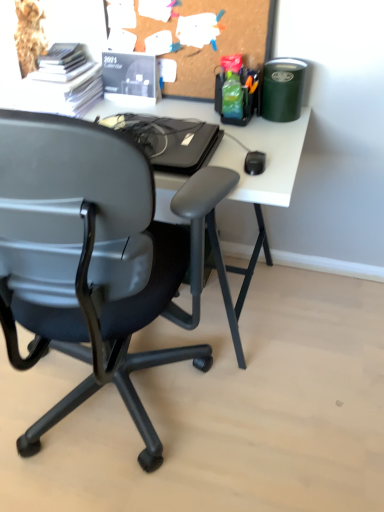
Question: Should I look upward or downward to see white paper stack at upper left, arranged as the 1th stationery when viewed from the left?

Choices:
 (A) down
 (B) up

Answer: (B)

Question: Is white paper stack at upper left, arranged as the 1th stationery when viewed from the left, not inside matte black calendar at upper center, the second stationery in the left-to-right sequence?

Choices:
 (A) no
 (B) yes

Answer: (B)

Question: Can you see white paper stack at upper left, arranged as the 1th stationery when viewed from the left, touching matte black calendar at upper center, the second stationery in the left-to-right sequence?

Choices:
 (A) yes
 (B) no

Answer: (B)

Question: Is matte black calendar at upper center, the second stationery in the left-to-right sequence, a part of white paper stack at upper left, arranged as the 1th stationery when viewed from the left?

Choices:
 (A) yes
 (B) no

Answer: (B)

Question: Can you confirm if white paper stack at upper left, which appears as the fourth stationery when viewed from the right, is positioned to the right of matte black calendar at upper center, which ranks as the 3th stationery in right-to-left order?

Choices:
 (A) no
 (B) yes

Answer: (A)

Question: From the image's perspective, is white paper stack at upper left, which appears as the fourth stationery when viewed from the right, on top of matte black calendar at upper center, the second stationery in the left-to-right sequence?

Choices:
 (A) no
 (B) yes

Answer: (A)

Question: Can you confirm if white paper stack at upper left, which appears as the fourth stationery when viewed from the right, is thinner than matte black calendar at upper center, the second stationery in the left-to-right sequence?

Choices:
 (A) yes
 (B) no

Answer: (B)

Question: From the image's perspective, is matte black calendar at upper center, which ranks as the 3th stationery in right-to-left order, under corkboard at upper center?

Choices:
 (A) no
 (B) yes

Answer: (B)

Question: Is matte black calendar at upper center, which ranks as the 3th stationery in right-to-left order, positioned far away from corkboard at upper center?

Choices:
 (A) yes
 (B) no

Answer: (B)

Question: Is the depth of matte black calendar at upper center, the second stationery in the left-to-right sequence, less than that of corkboard at upper center?

Choices:
 (A) yes
 (B) no

Answer: (B)

Question: Can we say matte black calendar at upper center, which ranks as the 3th stationery in right-to-left order, lies outside corkboard at upper center?

Choices:
 (A) no
 (B) yes

Answer: (B)

Question: Considering the relative positions of matte black calendar at upper center, the second stationery in the left-to-right sequence, and corkboard at upper center in the image provided, is matte black calendar at upper center, the second stationery in the left-to-right sequence, behind corkboard at upper center?

Choices:
 (A) no
 (B) yes

Answer: (B)

Question: Considering the relative sizes of matte black calendar at upper center, the second stationery in the left-to-right sequence, and corkboard at upper center in the image provided, is matte black calendar at upper center, the second stationery in the left-to-right sequence, wider than corkboard at upper center?

Choices:
 (A) yes
 (B) no

Answer: (A)

Question: Does white matte computer desk at upper center have a greater height compared to white paper stack at upper left, which appears as the fourth stationery when viewed from the right?

Choices:
 (A) yes
 (B) no

Answer: (A)